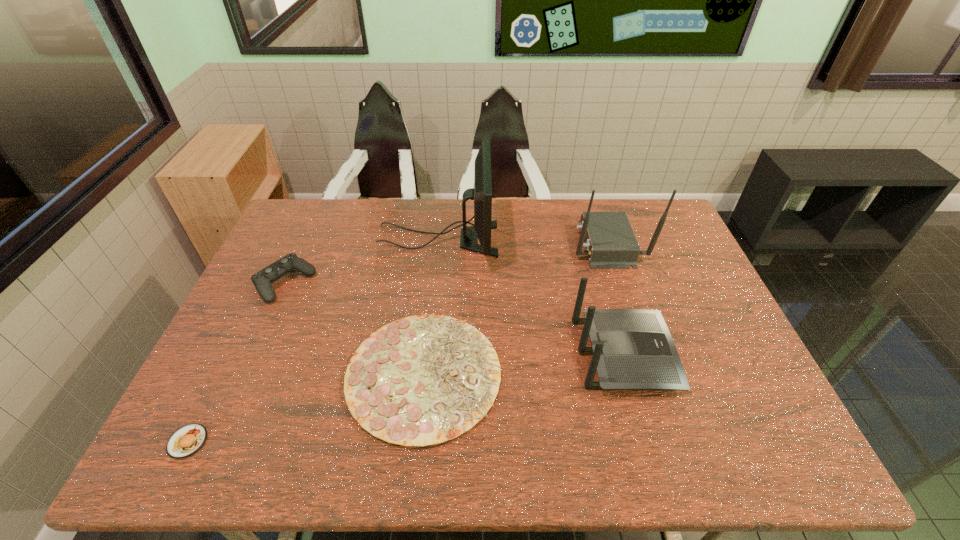
Where is `computer monitor`? This screenshot has width=960, height=540. computer monitor is located at coordinates (482, 192).

Identify the location of the farther router. The image size is (960, 540). (610, 242).

I want to click on the third tallest object, so click(632, 348).

This screenshot has width=960, height=540. Identify the location of the nearer router. (632, 348).

At what (x,y) coordinates should I click in order to perform the action: click on the third shortest object. Please return your answer as a coordinate pair (x, y). The image size is (960, 540). Looking at the image, I should click on point(262,280).

Where is `pizza`? pizza is located at coordinates (422, 380).

Locate an element on the screen. This screenshot has width=960, height=540. patty is located at coordinates (186, 441).

The image size is (960, 540). I want to click on vacant space located 0.170m on the screen side of the computer monitor, so click(x=548, y=239).

Locate an element on the screen. This screenshot has width=960, height=540. vacant space located on the back of the taller router to connect cables is located at coordinates (505, 244).

I want to click on free space located on the back of the taller router to connect cables, so click(x=463, y=244).